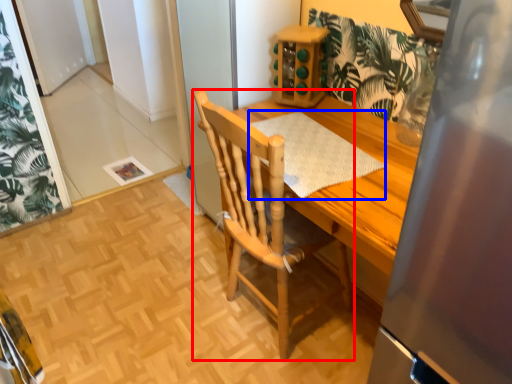
Question: Which object is closer to the camera taking this photo, chair (highlighted by a red box) or place mat (highlighted by a blue box)?

Choices:
 (A) chair
 (B) place mat

Answer: (A)